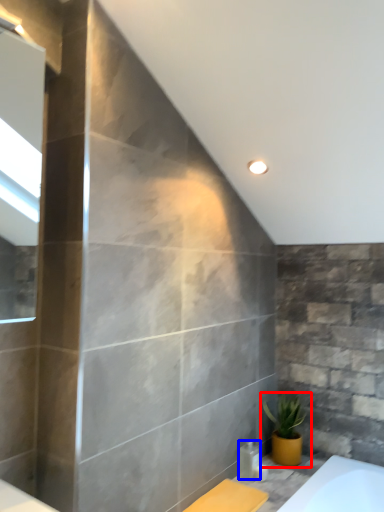
Question: Which object is further to the camera taking this photo, houseplant (highlighted by a red box) or toiletry (highlighted by a blue box)?

Choices:
 (A) houseplant
 (B) toiletry

Answer: (A)